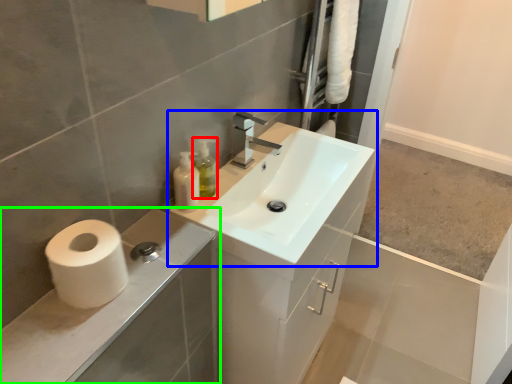
Question: Which object is the farthest from soap dispenser (highlighted by a red box)? Choose among these: sink (highlighted by a blue box) or bathroom cabinet (highlighted by a green box).

Choices:
 (A) sink
 (B) bathroom cabinet

Answer: (B)